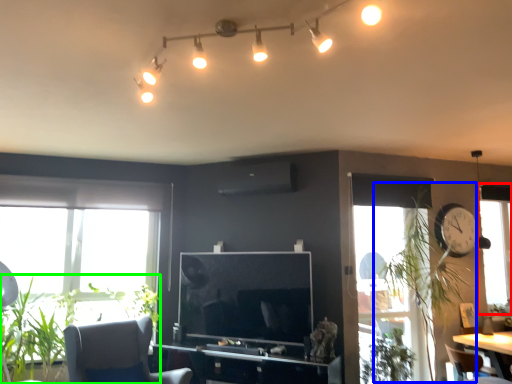
Question: Which is farther away from window (highlighted by a red box)? plant (highlighted by a blue box) or plant (highlighted by a green box)?

Choices:
 (A) plant
 (B) plant

Answer: (B)